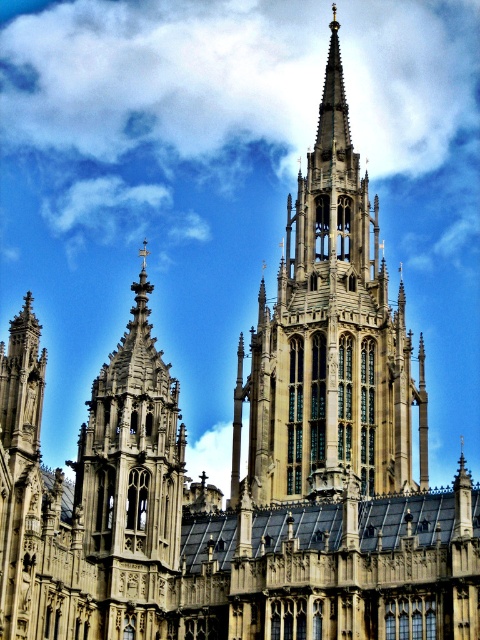
The height and width of the screenshot is (640, 480). I want to click on white fluffy cloud at upper center, so pyautogui.click(x=156, y=99).

The height and width of the screenshot is (640, 480). Identify the location of white fluffy cloud at upper center. (156, 99).